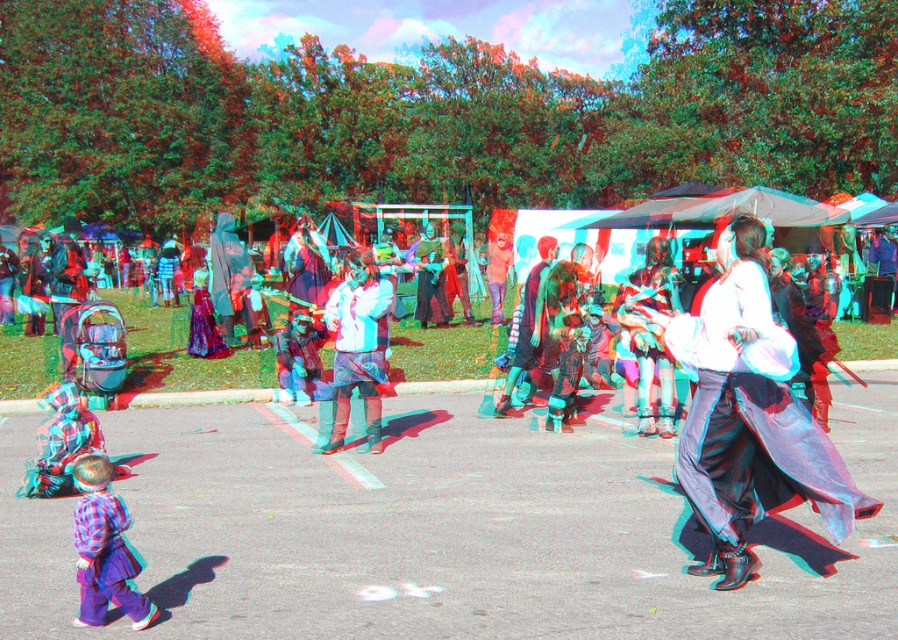
You are standing at the location of the plaid fabric shirt at lower left and want to hand a small item to the person wearing the white matte jacket at center. Given that the minimum safe social distance is 2 meters, can you reach them without moving closer than that distance?

The white matte jacket at center is 4.08 meters away from the plaid fabric shirt at lower left. Since the minimum safe social distance is 2 meters, you can hand the item without moving closer because the existing distance already exceeds the required 2 meters.